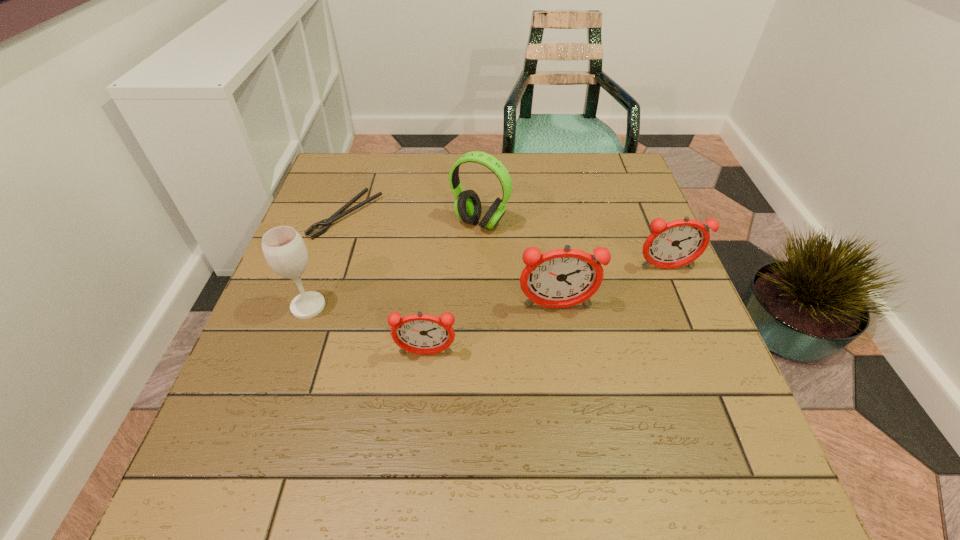
Find the location of a particular element. This screenshot has width=960, height=540. vacant space that is in between the leftmost alarm clock and the headset is located at coordinates (453, 288).

The image size is (960, 540). I want to click on vacant area between the shortest alarm clock and the rightmost alarm clock, so click(546, 311).

Find the location of a particular element. This screenshot has width=960, height=540. empty space that is in between the wineglass and the shortest alarm clock is located at coordinates (367, 330).

Image resolution: width=960 pixels, height=540 pixels. I want to click on vacant region between the rightmost alarm clock and the second alarm clock from left to right, so click(612, 288).

Where is `vacant area between the headset and the fourth nearest object`? The height and width of the screenshot is (540, 960). vacant area between the headset and the fourth nearest object is located at coordinates (573, 246).

The image size is (960, 540). I want to click on vacant space in between the wineglass and the second tallest alarm clock, so click(x=488, y=287).

You are a GUI agent. You are given a task and a screenshot of the screen. Output one action in this format:
    pyautogui.click(x=<x>, y=<y>)
    Task: Click on the object identified as the fifth closest to the second farthest alarm clock
    Image resolution: width=960 pixels, height=540 pixels.
    Given the screenshot: What is the action you would take?
    pyautogui.click(x=283, y=247)

Locate which object is the fourth closest to the second farthest alarm clock. Please provide its 2D coordinates. Your answer should be formatted as a tuple, i.e. [(x, y)], where the tuple contains the x and y coordinates of a point satisfying the conditions above.

[(326, 223)]

Choose which alarm clock is the nearest neighbor to the headset. Please provide its 2D coordinates. Your answer should be formatted as a tuple, i.e. [(x, y)], where the tuple contains the x and y coordinates of a point satisfying the conditions above.

[(559, 278)]

Find the location of a particular element. This screenshot has width=960, height=540. alarm clock that is the second closest to the tongs is located at coordinates (559, 278).